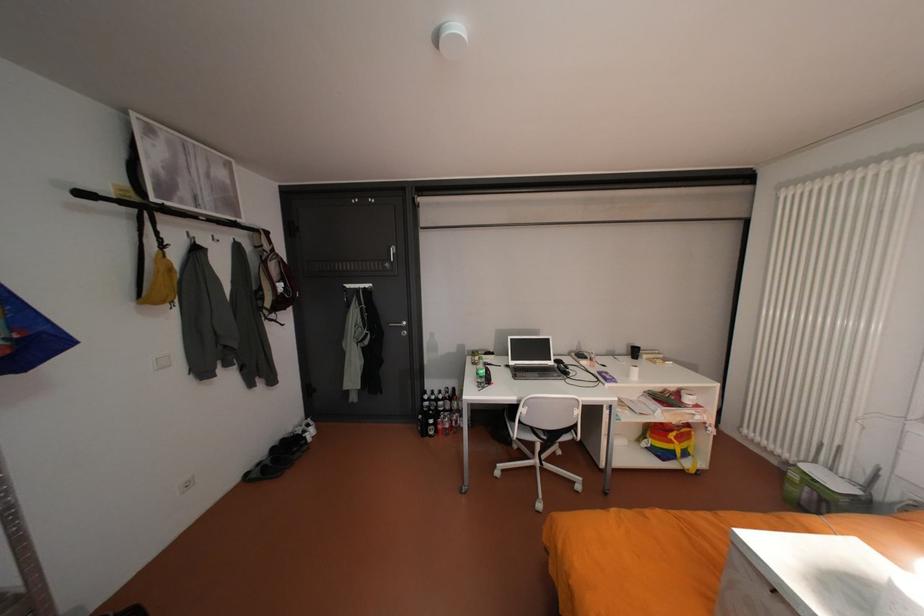
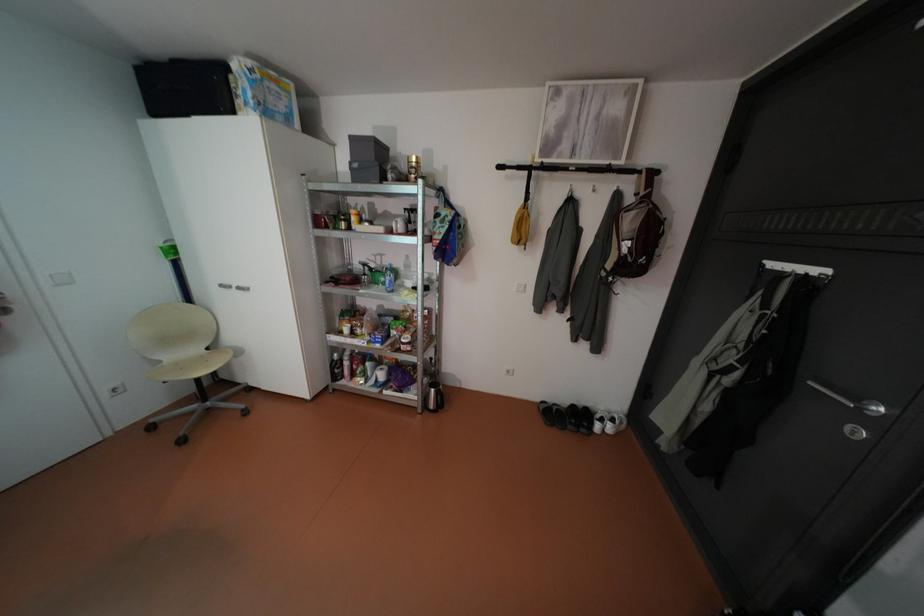
Where in the second image is the point corresponding to [91,193] from the first image?

(508, 166)